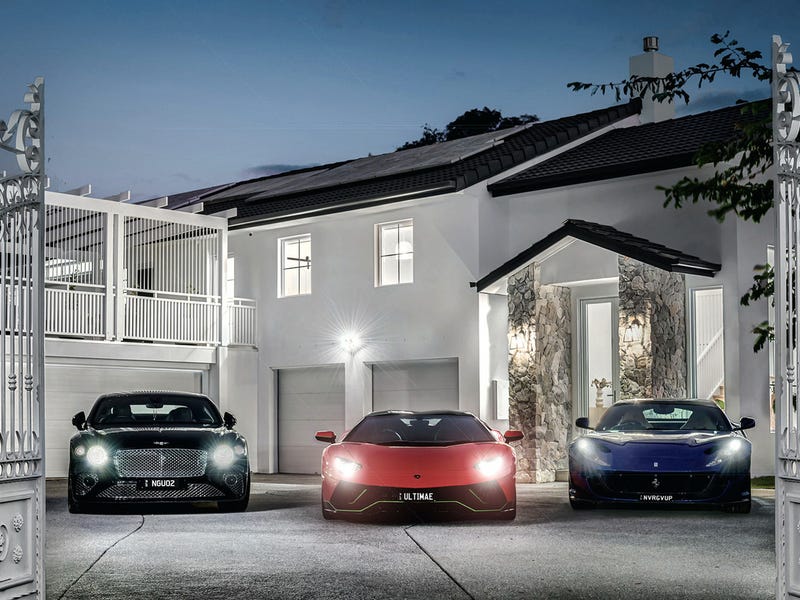
The height and width of the screenshot is (600, 800). Find the location of `left garage door`. left garage door is located at coordinates (306, 395).